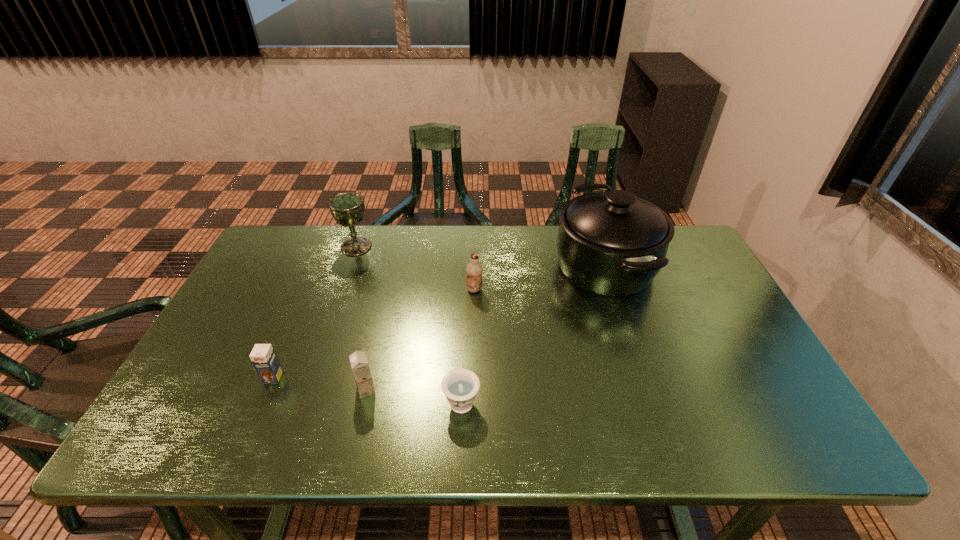
The height and width of the screenshot is (540, 960). What are the coordinates of `vacant space in between the fifth object from right to left and the third object from left to right` in the screenshot? It's located at (361, 318).

Locate an element on the screen. free space between the second chocolate milk from right to left and the rightmost chocolate milk is located at coordinates (420, 340).

Identify the location of unoccupied area between the rightmost object and the leftmost object. [440, 321].

Identify the location of free space between the farthest chocolate milk and the rightmost object. The width and height of the screenshot is (960, 540). (540, 278).

Find the location of `empty space that is in between the fifth object from right to left and the third object from left to right`. empty space that is in between the fifth object from right to left and the third object from left to right is located at coordinates (361, 318).

Identify which object is the second nearest to the farthest chocolate milk. Please provide its 2D coordinates. Your answer should be formatted as a tuple, i.e. [(x, y)], where the tuple contains the x and y coordinates of a point satisfying the conditions above.

[(460, 386)]

Choose which object is the fourth nearest neighbor to the fifth object from right to left. Please provide its 2D coordinates. Your answer should be formatted as a tuple, i.e. [(x, y)], where the tuple contains the x and y coordinates of a point satisfying the conditions above.

[(460, 386)]

The image size is (960, 540). What are the coordinates of `chocolate milk that is the second closest one to the rightmost chocolate milk` in the screenshot? It's located at (263, 357).

What are the coordinates of `the second closest chocolate milk to the second chocolate milk from left to right` in the screenshot? It's located at (474, 269).

Identify the location of free location that satisfies the following two spatial constraints: 1. on the side of the farthest chocolate milk with the handle; 2. on the left side of the shortest object. pyautogui.click(x=466, y=290).